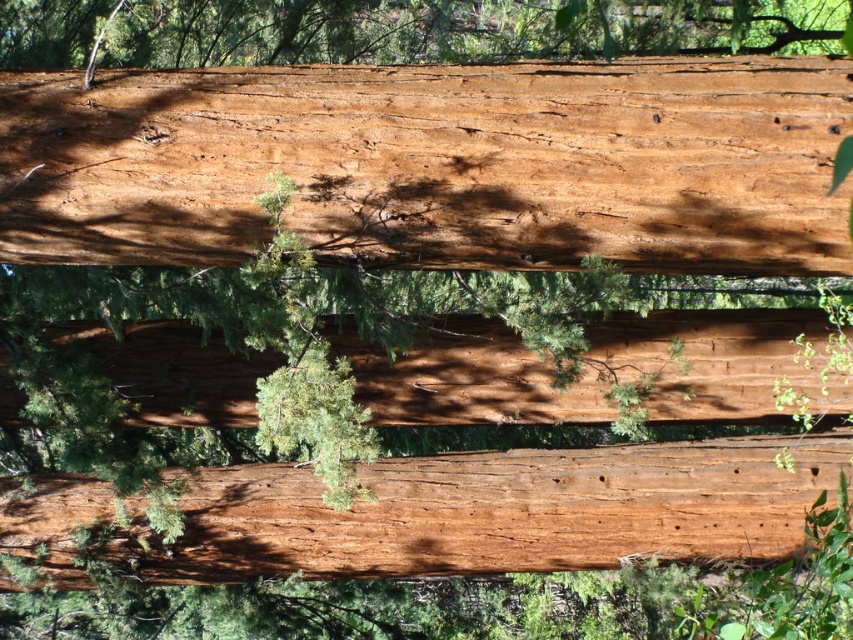
You are standing in a forest and see a large wooden structure. There is a point at coordinates (436,164) on the structure. What is the color and texture of the surface at that point?

The point at coordinates (436,164) indicates smooth reddish brown wood at center.